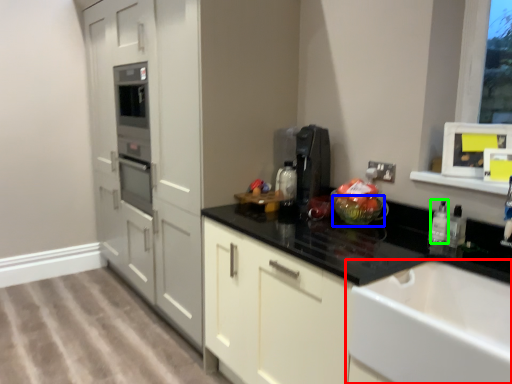
Question: Estimate the real-world distances between objects in this image. Which object is closer to sink (highlighted by a red box), glass bowl (highlighted by a blue box) or bottle (highlighted by a green box)?

Choices:
 (A) glass bowl
 (B) bottle

Answer: (B)